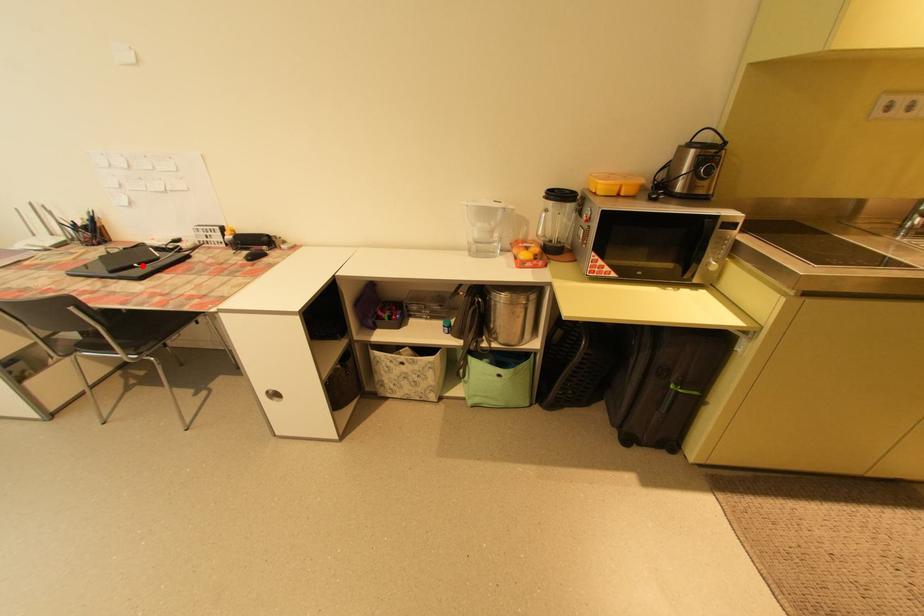
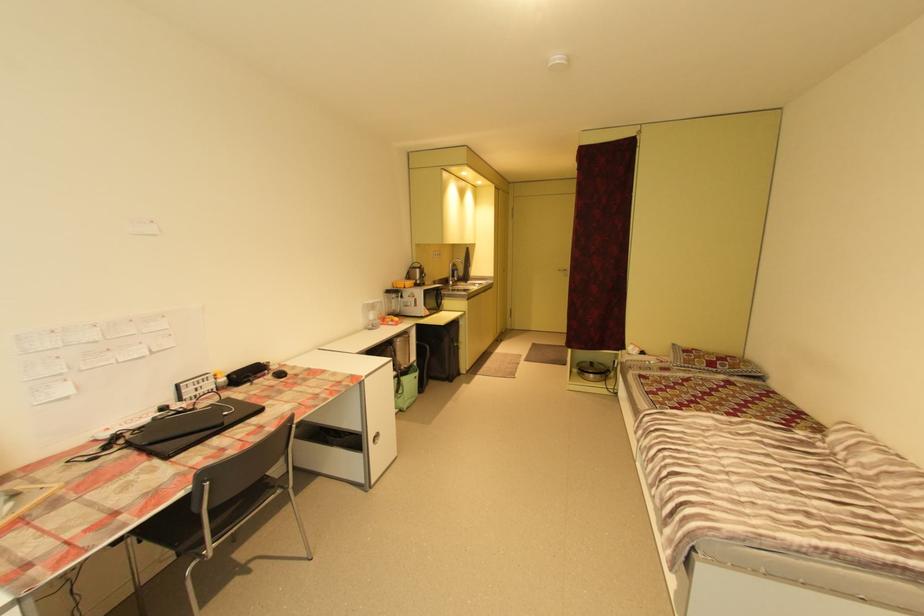
Locate, in the second image, the point that corresponds to the highlighted location in the first image.

(232, 414)